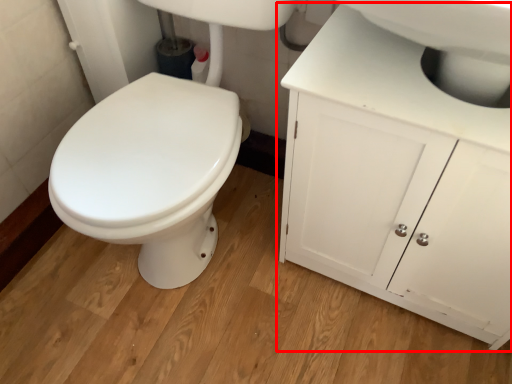
Question: Considering the relative positions of bathroom cabinet (annotated by the red box) and sink in the image provided, where is bathroom cabinet (annotated by the red box) located with respect to the staircase?

Choices:
 (A) right
 (B) left

Answer: (A)